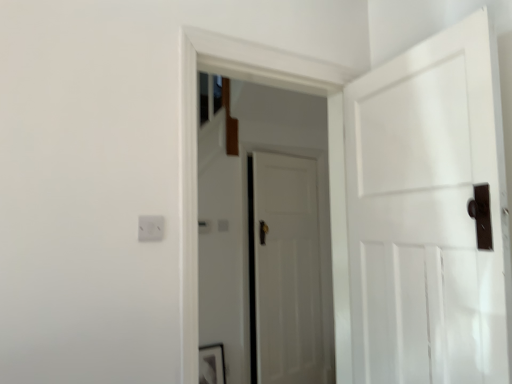
Question: In which direction should I rotate to look at white matte door at center, which is the first door from back to front?

Choices:
 (A) left
 (B) right

Answer: (B)

Question: Could you tell me if white matte door at center, which is the first door from back to front, is turned towards matte black picture frame at lower center?

Choices:
 (A) no
 (B) yes

Answer: (A)

Question: From a real-world perspective, is white matte door at center, positioned as the 2th door in front-to-back order, physically below matte black picture frame at lower center?

Choices:
 (A) yes
 (B) no

Answer: (B)

Question: Is white matte door at center, which is the first door from back to front, next to matte black picture frame at lower center?

Choices:
 (A) yes
 (B) no

Answer: (B)

Question: Can you confirm if white matte door at center, positioned as the 2th door in front-to-back order, is bigger than matte black picture frame at lower center?

Choices:
 (A) yes
 (B) no

Answer: (A)

Question: Is matte black picture frame at lower center inside white matte door at center, which is the first door from back to front?

Choices:
 (A) yes
 (B) no

Answer: (B)

Question: Considering the relative sizes of white matte door at center, which is the first door from back to front, and matte black picture frame at lower center in the image provided, is white matte door at center, which is the first door from back to front, taller than matte black picture frame at lower center?

Choices:
 (A) yes
 (B) no

Answer: (A)

Question: Is white matte door at center, which is the first door from back to front, looking in the opposite direction of white matte door at center, the 1th door from the front?

Choices:
 (A) yes
 (B) no

Answer: (B)

Question: Would you say white matte door at center, positioned as the 2th door in front-to-back order, is a long distance from white matte door at center, marked as the 2th door in a back-to-front arrangement?

Choices:
 (A) no
 (B) yes

Answer: (B)

Question: Is the position of white matte door at center, positioned as the 2th door in front-to-back order, more distant than that of white matte door at center, marked as the 2th door in a back-to-front arrangement?

Choices:
 (A) no
 (B) yes

Answer: (B)

Question: Could you tell me if white matte door at center, positioned as the 2th door in front-to-back order, is facing white matte door at center, marked as the 2th door in a back-to-front arrangement?

Choices:
 (A) no
 (B) yes

Answer: (A)

Question: From the image's perspective, is white matte door at center, which is the first door from back to front, on white matte door at center, the 1th door from the front?

Choices:
 (A) yes
 (B) no

Answer: (B)

Question: Can you confirm if white matte door at center, positioned as the 2th door in front-to-back order, is taller than white matte door at center, the 1th door from the front?

Choices:
 (A) no
 (B) yes

Answer: (B)

Question: From a real-world perspective, does white matte door at center, the 1th door from the front, stand above matte black picture frame at lower center?

Choices:
 (A) no
 (B) yes

Answer: (B)